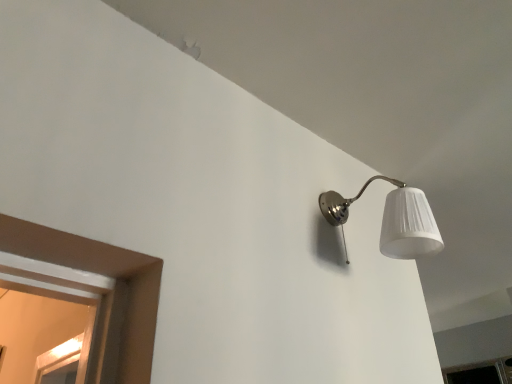
Question: Is transparent glass window at lower right wider or thinner than satin nickel lampshade at upper right?

Choices:
 (A) thin
 (B) wide

Answer: (B)

Question: Considering the relative positions of transparent glass window at lower right and satin nickel lampshade at upper right in the image provided, is transparent glass window at lower right to the left or to the right of satin nickel lampshade at upper right?

Choices:
 (A) left
 (B) right

Answer: (B)

Question: Does point (498, 372) appear closer or farther from the camera than point (416, 238)?

Choices:
 (A) closer
 (B) farther

Answer: (B)

Question: Is satin nickel lampshade at upper right in front of or behind transparent glass window at lower right in the image?

Choices:
 (A) behind
 (B) front

Answer: (B)

Question: From a real-world perspective, is satin nickel lampshade at upper right physically located above or below transparent glass window at lower right?

Choices:
 (A) below
 (B) above

Answer: (B)

Question: Considering the relative positions of satin nickel lampshade at upper right and transparent glass window at lower right in the image provided, is satin nickel lampshade at upper right to the left or to the right of transparent glass window at lower right?

Choices:
 (A) left
 (B) right

Answer: (A)

Question: Is point (364, 187) positioned closer to the camera than point (459, 377)?

Choices:
 (A) closer
 (B) farther

Answer: (A)